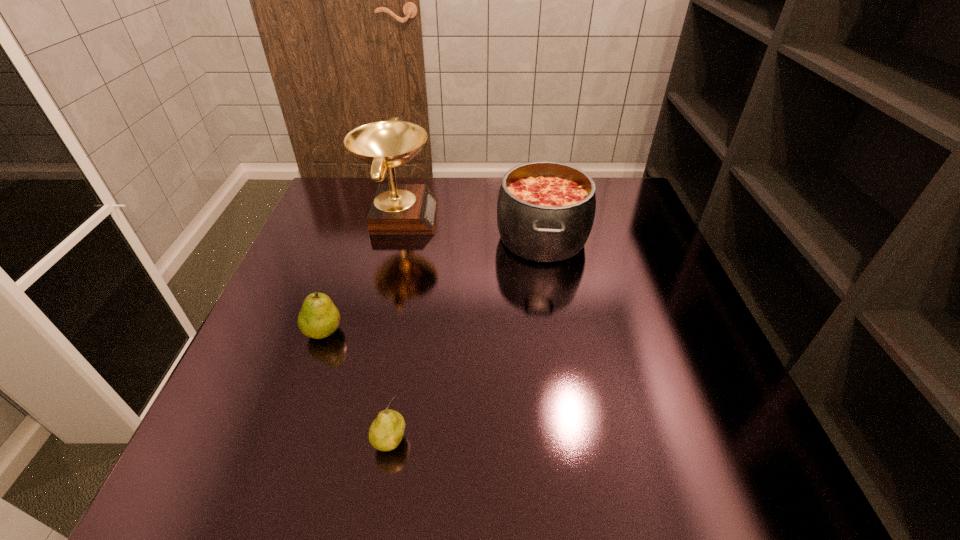
Identify the location of vacant space that satisfies the following two spatial constraints: 1. on the front-facing side of the award; 2. on the front side of the third farthest object. This screenshot has height=540, width=960. (371, 331).

You are a GUI agent. You are given a task and a screenshot of the screen. Output one action in this format:
    pyautogui.click(x=<x>, y=<y>)
    Task: Click on the free spot that satisfies the following two spatial constraints: 1. on the back side of the nearer pear; 2. on the right side of the rightmost object
    This screenshot has height=540, width=960.
    Given the screenshot: What is the action you would take?
    pyautogui.click(x=422, y=238)

Where is `free space that satisfies the following two spatial constraints: 1. on the front-facing side of the award; 2. on the left side of the nearest object`? free space that satisfies the following two spatial constraints: 1. on the front-facing side of the award; 2. on the left side of the nearest object is located at coordinates (345, 441).

Where is `free location that satisfies the following two spatial constraints: 1. on the front-facing side of the award; 2. on the left side of the rightmost object`? This screenshot has width=960, height=540. free location that satisfies the following two spatial constraints: 1. on the front-facing side of the award; 2. on the left side of the rightmost object is located at coordinates (394, 238).

Find the location of a particular element. This screenshot has height=540, width=960. vacant area that satisfies the following two spatial constraints: 1. on the front-facing side of the shortest object; 2. on the left side of the award is located at coordinates (345, 441).